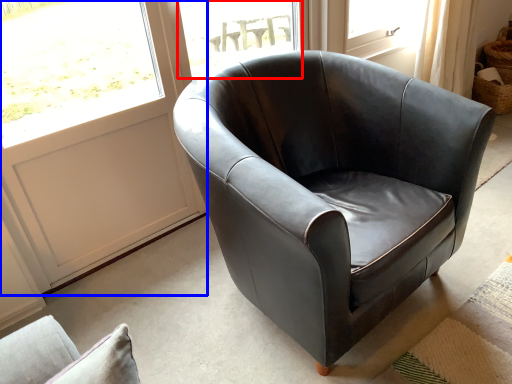
Question: Among these objects, which one is nearest to the camera, window (highlighted by a red box) or screen door (highlighted by a blue box)?

Choices:
 (A) window
 (B) screen door

Answer: (B)